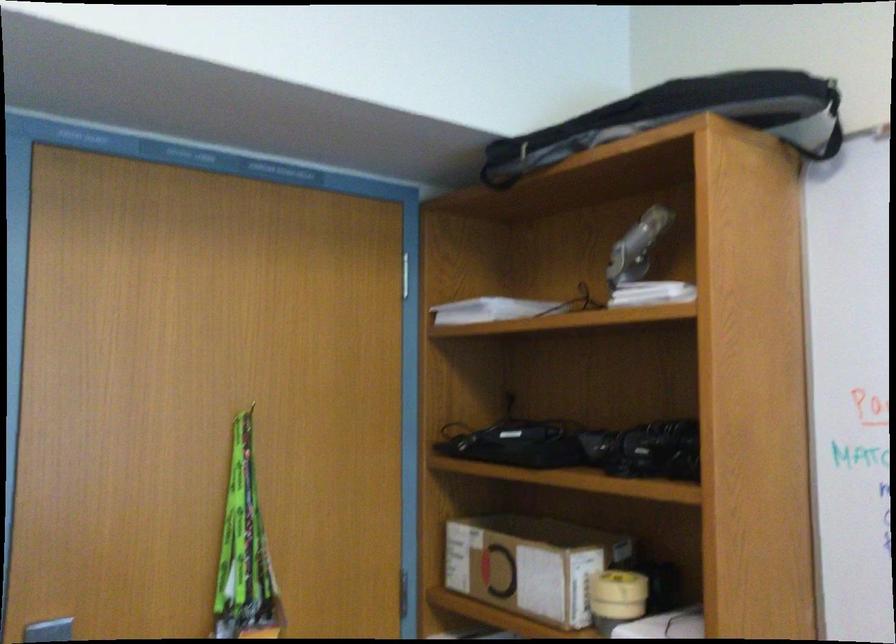
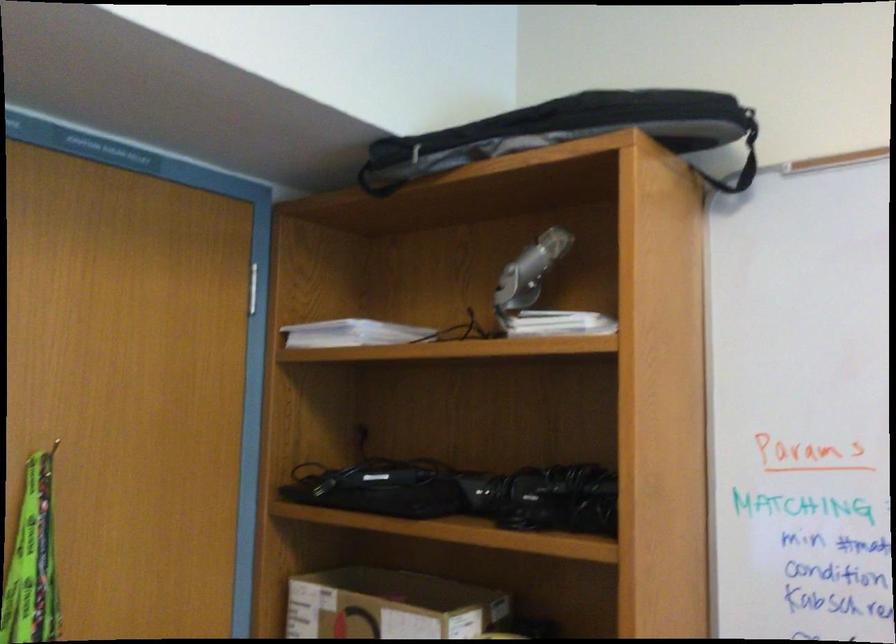
Locate, in the second image, the point that corresponds to [521,544] in the first image.

(389, 605)